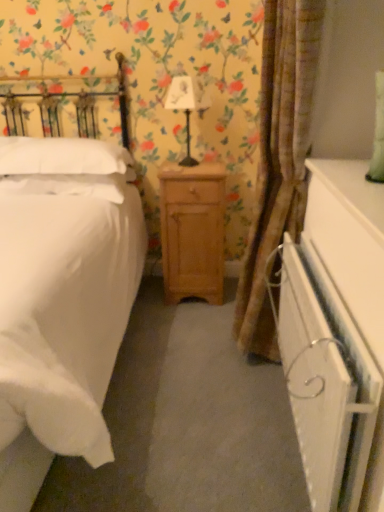
Where is `unoccupied area in front of light brown wood nightstand at center`? The height and width of the screenshot is (512, 384). unoccupied area in front of light brown wood nightstand at center is located at coordinates (187, 323).